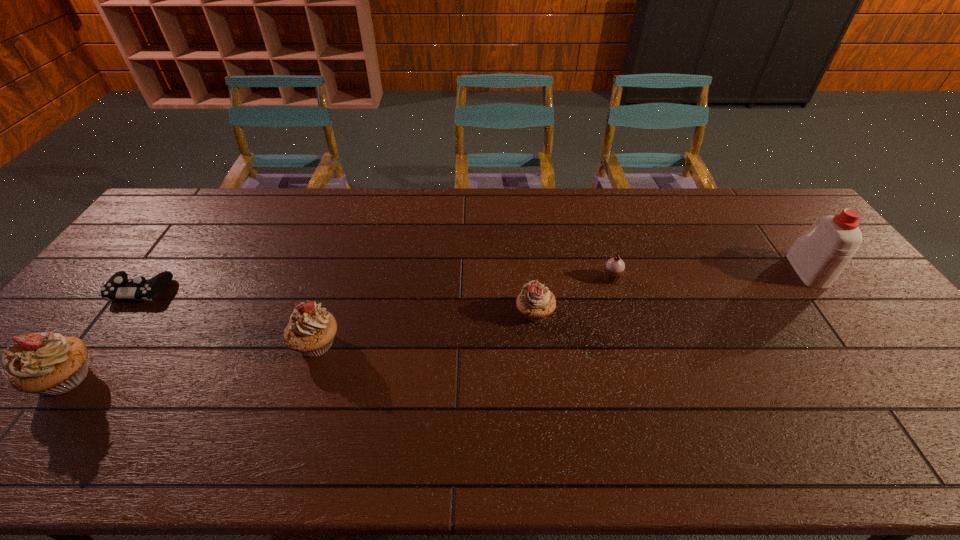
Identify the location of the leftmost cupcake. The width and height of the screenshot is (960, 540). (50, 364).

The height and width of the screenshot is (540, 960). Find the location of `the fourth object from right to left`. the fourth object from right to left is located at coordinates (311, 329).

Locate an element on the screen. The image size is (960, 540). the third tallest object is located at coordinates (311, 329).

The width and height of the screenshot is (960, 540). Find the location of `the fourth object from left to right`. the fourth object from left to right is located at coordinates (535, 302).

This screenshot has width=960, height=540. Identify the location of the second cupcake from right to left. (535, 302).

Find the location of `control`. control is located at coordinates [x=118, y=286].

I want to click on detergent, so click(x=818, y=257).

The height and width of the screenshot is (540, 960). I want to click on the rightmost object, so click(818, 257).

The height and width of the screenshot is (540, 960). What are the coordinates of `the shortest cupcake` in the screenshot? It's located at (614, 268).

This screenshot has height=540, width=960. I want to click on the fifth object from left to right, so click(614, 268).